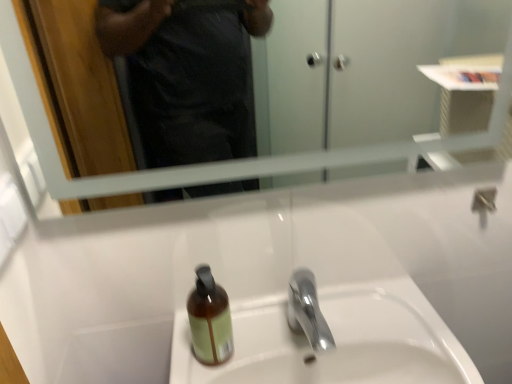
Identify the location of vacant region to the left of polished chrome faucet at center. (244, 345).